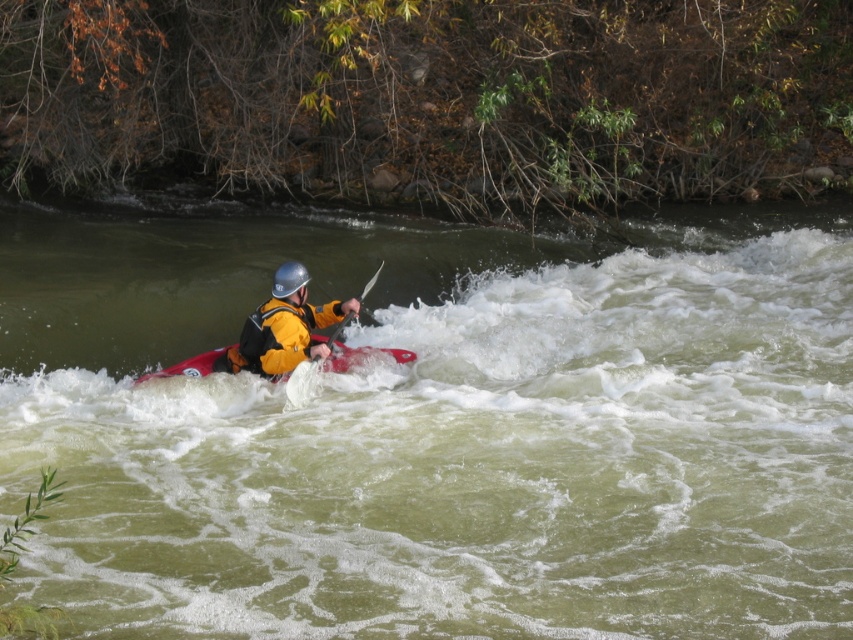
Who is more distant from viewer, (480, 273) or (296, 268)?

Point (480, 273)

Is point (161, 390) positioned in front of point (299, 266)?

Yes, it is.

Find the location of a particular element. This screenshot has height=640, width=853. green rubber kayak at center is located at coordinates (438, 429).

Is green rubber kayak at center smaller than red matte kayak at center?

No.

Is green rubber kayak at center closer to camera compared to red matte kayak at center?

Yes, green rubber kayak at center is in front of red matte kayak at center.

Who is more forward, (743, 403) or (190, 369)?

Positioned in front is point (743, 403).

Locate an element on the screen. green rubber kayak at center is located at coordinates (438, 429).

Between point (241, 349) and point (305, 268), which one is positioned behind?

Positioned behind is point (305, 268).

Between yellow matte jacket at center and silver metallic helmet at center, which one has more height?

yellow matte jacket at center is taller.

The height and width of the screenshot is (640, 853). What do you see at coordinates (283, 326) in the screenshot?
I see `yellow matte jacket at center` at bounding box center [283, 326].

Locate an element on the screen. This screenshot has height=640, width=853. yellow matte jacket at center is located at coordinates (283, 326).